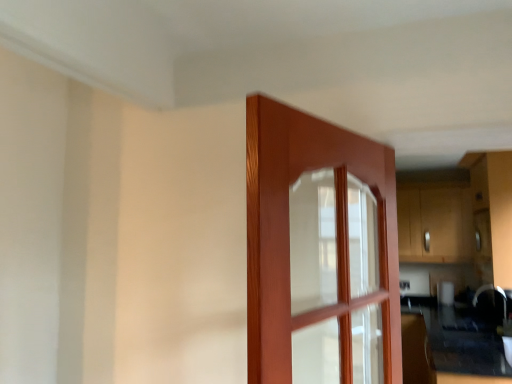
This screenshot has width=512, height=384. What do you see at coordinates (450, 348) in the screenshot?
I see `black glossy countertop at lower right` at bounding box center [450, 348].

Find the location of `black glossy countertop at lower right`. black glossy countertop at lower right is located at coordinates (450, 348).

The width and height of the screenshot is (512, 384). Find the location of `black glossy countertop at lower right`. black glossy countertop at lower right is located at coordinates (450, 348).